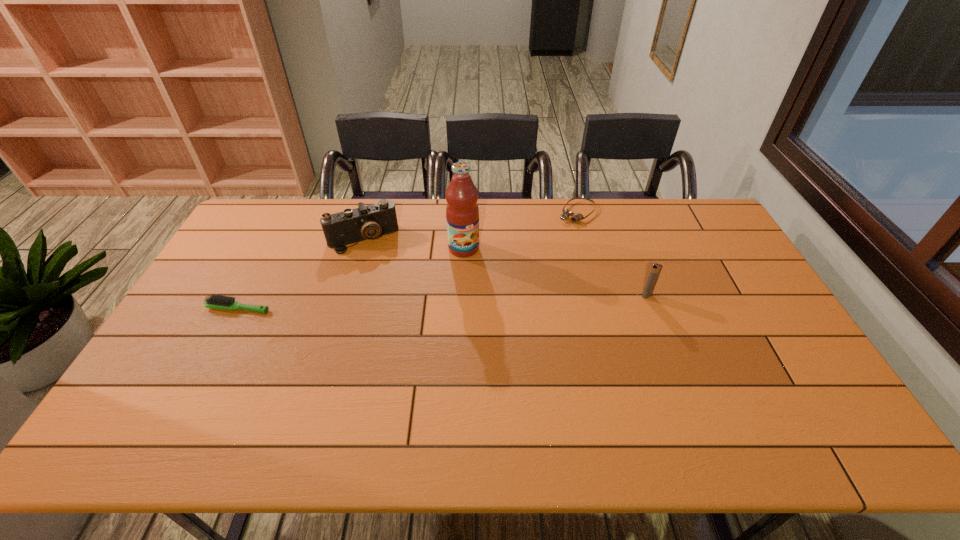
Find the location of a particular element. the leftmost object is located at coordinates (214, 301).

Identify the location of the nearest object. (214, 301).

In order to click on igniter in this screenshot , I will do `click(655, 271)`.

Where is `the fourth farthest object`? Image resolution: width=960 pixels, height=540 pixels. the fourth farthest object is located at coordinates (655, 271).

Locate an element on the screen. This screenshot has height=540, width=960. the third object from right to left is located at coordinates (462, 212).

Where is `fruit juice`? The width and height of the screenshot is (960, 540). fruit juice is located at coordinates (462, 212).

At what (x,y) coordinates should I click in order to perform the action: click on camera. Please return your answer as a coordinate pair (x, y). Looking at the image, I should click on (369, 222).

You are a GUI agent. You are given a task and a screenshot of the screen. Output one action in this format:
    pyautogui.click(x=<x>, y=<y>)
    Task: Click on the goggles
    Image resolution: width=960 pixels, height=540 pixels.
    Given the screenshot: What is the action you would take?
    pyautogui.click(x=566, y=213)

Where is `vacant area situated on the back of the nearest object`? The image size is (960, 540). vacant area situated on the back of the nearest object is located at coordinates (268, 253).

Image resolution: width=960 pixels, height=540 pixels. What are the coordinates of `free region located 0.240m on the front of the second nearest object` in the screenshot? It's located at (673, 365).